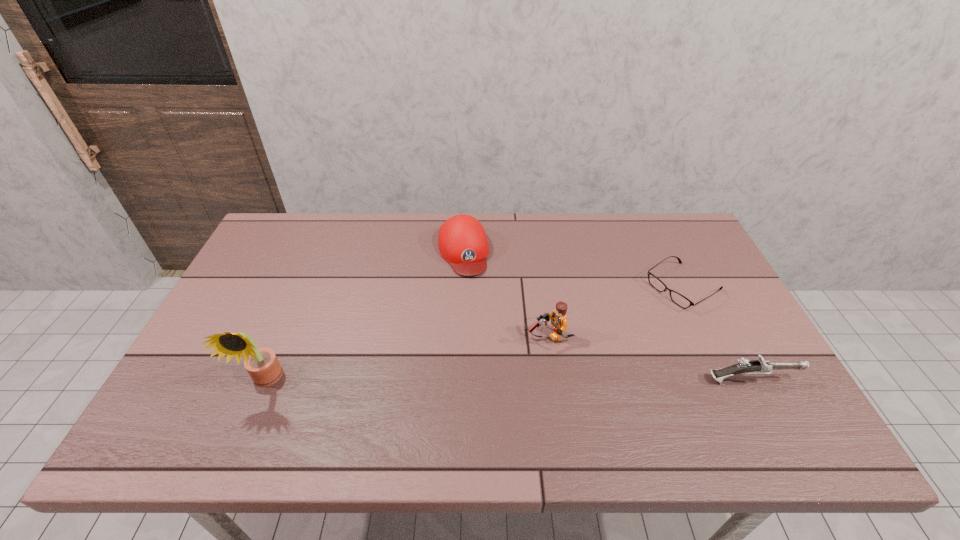
Where is `free spot on the desktop that is between the tallest object and the gun and is positioned on the front-facing side of the shortest object`? free spot on the desktop that is between the tallest object and the gun and is positioned on the front-facing side of the shortest object is located at coordinates (532, 380).

I want to click on vacant space on the desktop that is between the sunflower and the gun and is positioned holding a crossbow in the hands of the third object from left to right, so click(461, 380).

Where is `free space on the desktop that is between the tallest object and the gun and is positioned on the front-facing side of the second object from left to right`? free space on the desktop that is between the tallest object and the gun and is positioned on the front-facing side of the second object from left to right is located at coordinates (504, 380).